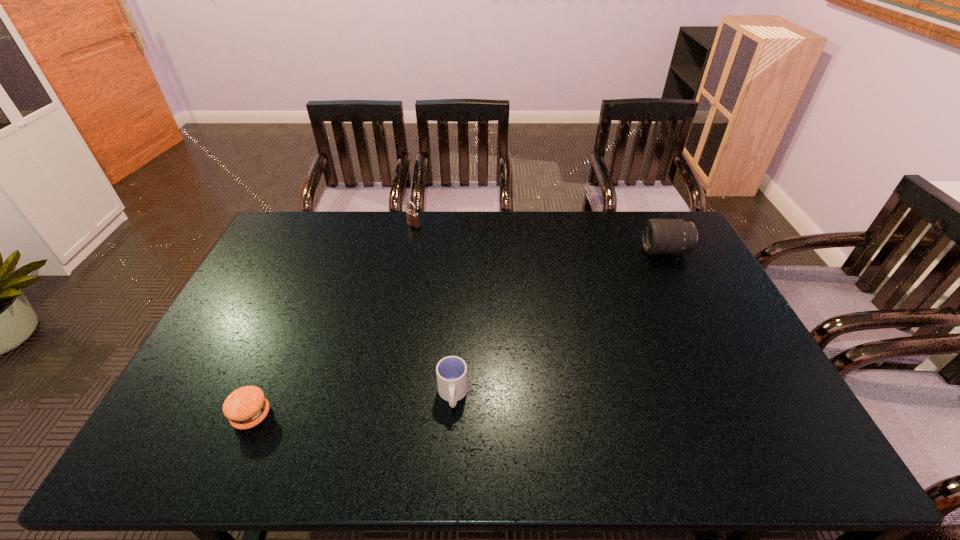
Image resolution: width=960 pixels, height=540 pixels. I want to click on blank region between the third tallest object and the padlock, so click(433, 310).

The image size is (960, 540). Identify the location of vacant region between the padlock and the second farthest object. [540, 239].

Locate an element on the screen. The image size is (960, 540). empty space that is in between the second farthest object and the farthest object is located at coordinates (540, 239).

I want to click on free space that is in between the telephoto lens and the padlock, so click(x=540, y=239).

You are a GUI agent. You are given a task and a screenshot of the screen. Output one action in this format:
    pyautogui.click(x=<x>, y=<y>)
    Task: Click on the unoccupied position between the third object from left to right and the third nearest object
    
    Given the screenshot: What is the action you would take?
    pyautogui.click(x=559, y=323)

Image resolution: width=960 pixels, height=540 pixels. What are the coordinates of `free point between the telephoto lens and the third object from right to left` in the screenshot? It's located at (540, 239).

Where is `free spot between the cup and the patty`? This screenshot has width=960, height=540. free spot between the cup and the patty is located at coordinates (352, 406).

The height and width of the screenshot is (540, 960). I want to click on unoccupied area between the leftmost object and the third nearest object, so click(459, 333).

Select which object appears as the second closest to the second farthest object. Please provide its 2D coordinates. Your answer should be formatted as a tuple, i.e. [(x, y)], where the tuple contains the x and y coordinates of a point satisfying the conditions above.

[(412, 216)]

The image size is (960, 540). In order to click on the second closest object to the second shortest object in this screenshot , I will do `click(412, 216)`.